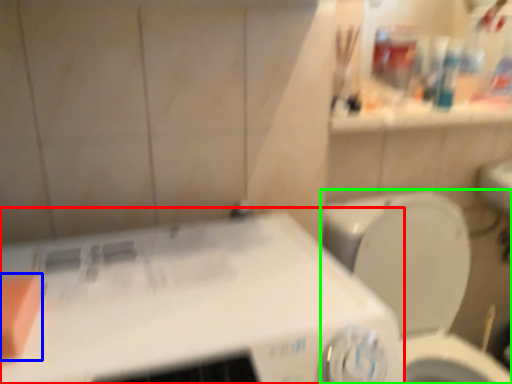
Question: Considering the real-world distances, which object is closest to appliance (highlighted by a red box)? soap (highlighted by a blue box) or toilet (highlighted by a green box).

Choices:
 (A) soap
 (B) toilet

Answer: (A)